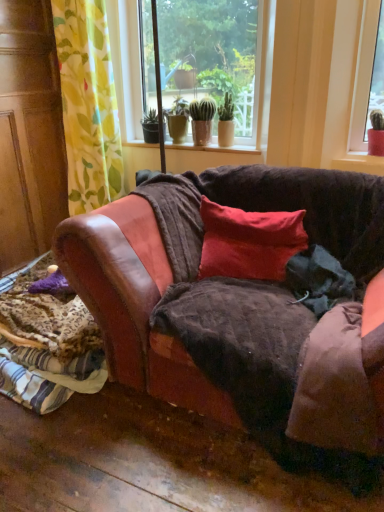
This screenshot has width=384, height=512. I want to click on free spot above smooth concrete window sill at center (from a real-world perspective), so pos(198,143).